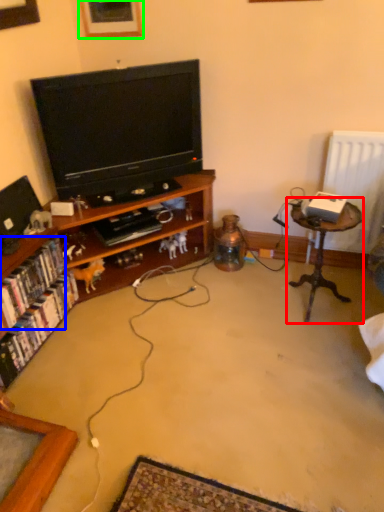
Question: Estimate the real-world distances between objects in this image. Which object is farther from table (highlighted by a red box), book (highlighted by a blue box) or picture frame (highlighted by a green box)?

Choices:
 (A) book
 (B) picture frame

Answer: (B)